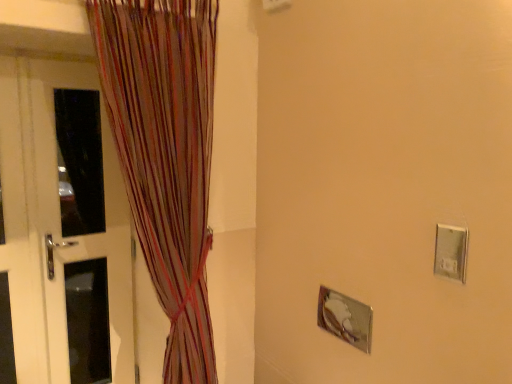
Question: From the image's perspective, relative to white glossy door at left, is silver metallic electric outlet at right above or below?

Choices:
 (A) above
 (B) below

Answer: (A)

Question: Is silver metallic electric outlet at right in front of or behind white glossy door at left in the image?

Choices:
 (A) front
 (B) behind

Answer: (A)

Question: Considering the real-world distances, which object is closest to the multicolored striped curtain at left?

Choices:
 (A) white glossy door at left
 (B) silver metallic electric outlet at right

Answer: (A)

Question: Which of these objects is positioned farthest from the white glossy door at left?

Choices:
 (A) silver metallic electric outlet at right
 (B) multicolored striped curtain at left

Answer: (A)